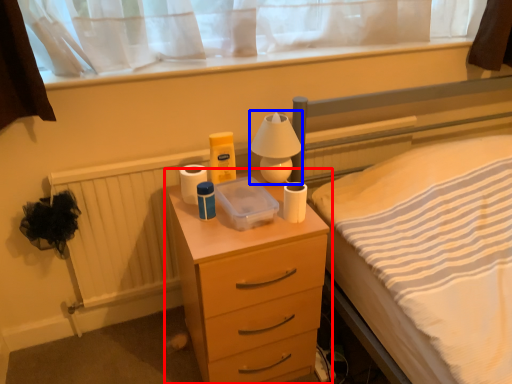
Question: Which object is further to the camera taking this photo, chest of drawers (highlighted by a red box) or bedside lamp (highlighted by a blue box)?

Choices:
 (A) chest of drawers
 (B) bedside lamp

Answer: (B)